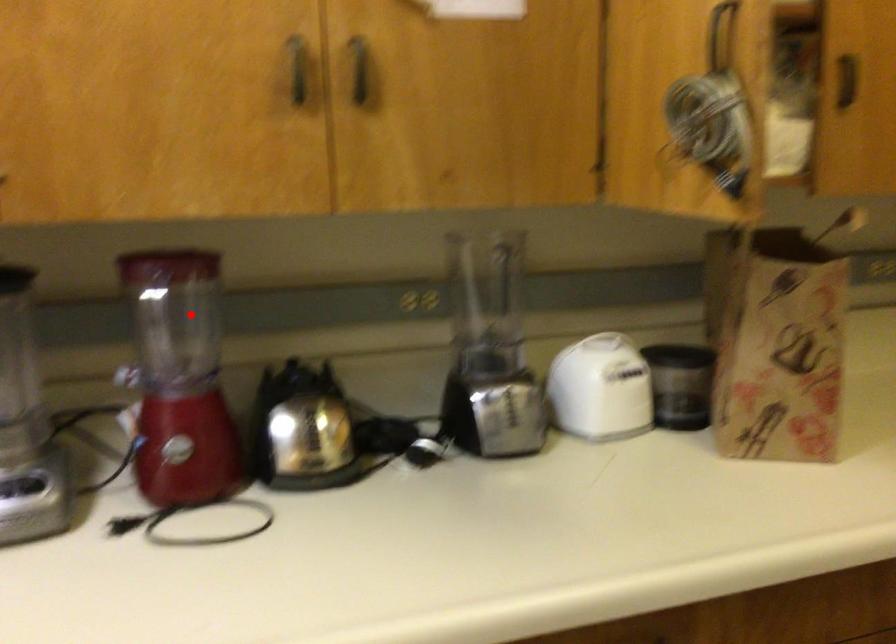
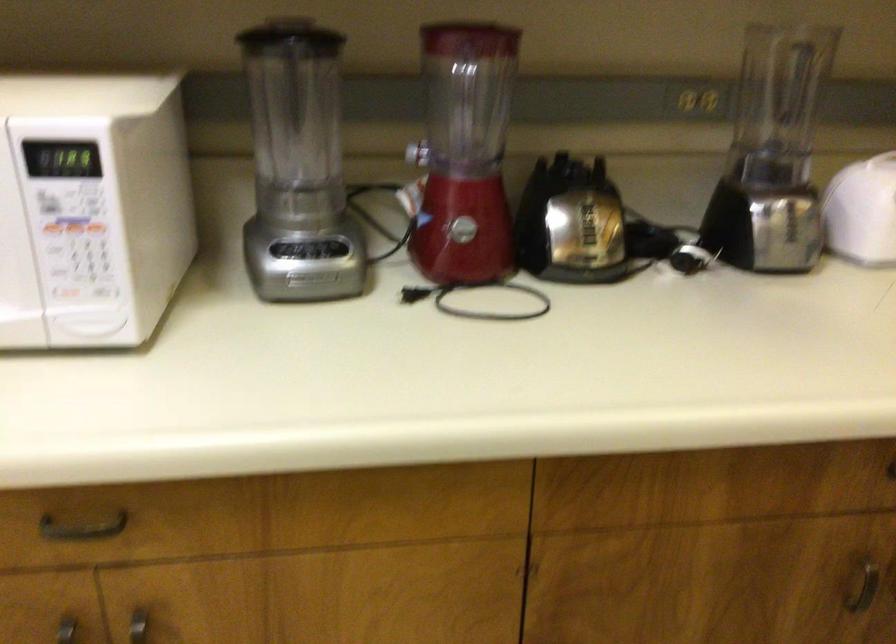
Where in the second image is the point corresponding to the highlighted location from the first image?

(467, 93)